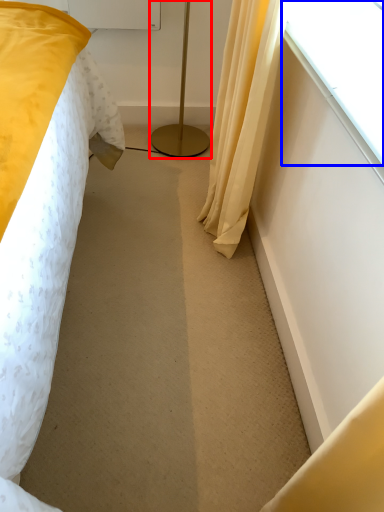
Question: Which object appears closest to the camera in this image, lamp (highlighted by a red box) or window (highlighted by a blue box)?

Choices:
 (A) lamp
 (B) window

Answer: (B)